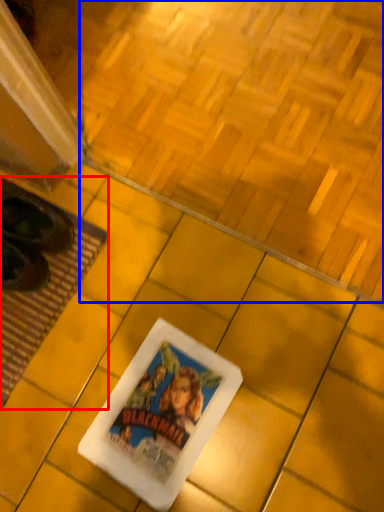
Question: Which of the following is the farthest to the observer, mat (highlighted by a red box) or square (highlighted by a blue box)?

Choices:
 (A) mat
 (B) square

Answer: (A)